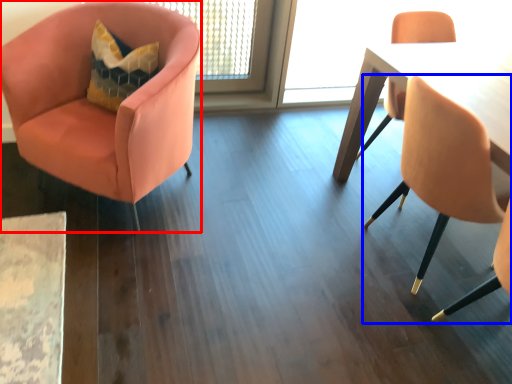
Question: Among these objects, which one is farthest to the camera, chair (highlighted by a red box) or chair (highlighted by a blue box)?

Choices:
 (A) chair
 (B) chair

Answer: (A)